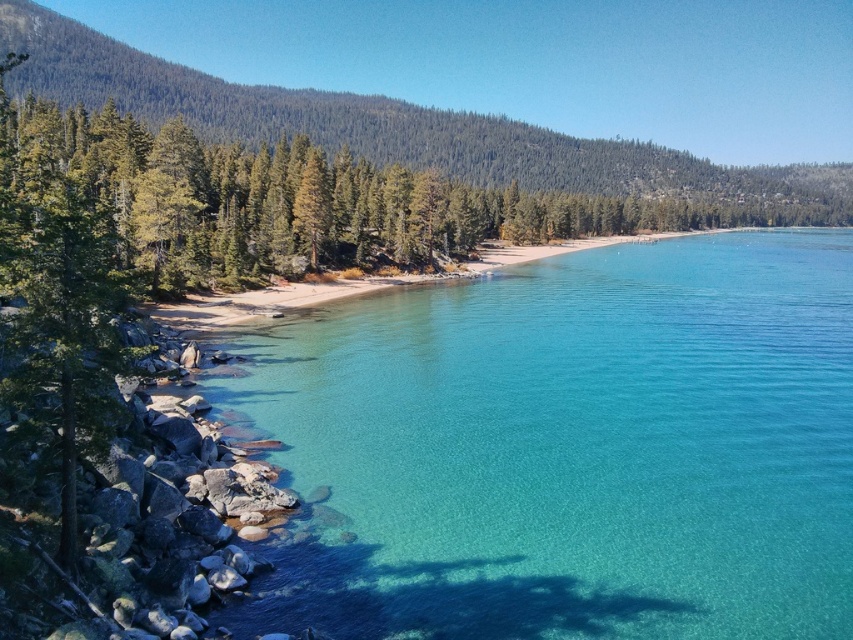
Who is lower down, clear glassy water at center or green matte tree at left?

clear glassy water at center is lower down.

How far apart are clear glassy water at center and green matte tree at left?

The distance of clear glassy water at center from green matte tree at left is 113.99 feet.

Between point (651, 490) and point (96, 454), which one is positioned behind?

Point (651, 490)

The image size is (853, 640). In order to click on clear glassy water at center in this screenshot , I will do `click(569, 449)`.